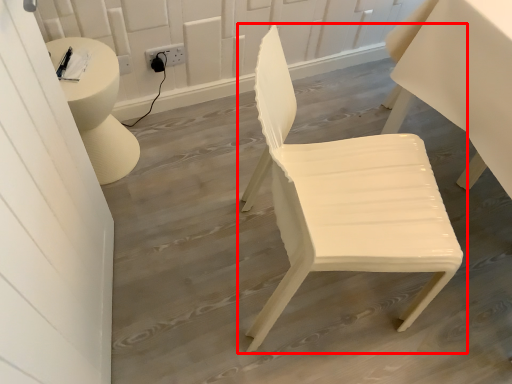
Question: Considering the relative positions of chair (annotated by the red box) and electric outlet in the image provided, where is chair (annotated by the red box) located with respect to the staircase?

Choices:
 (A) left
 (B) right

Answer: (B)